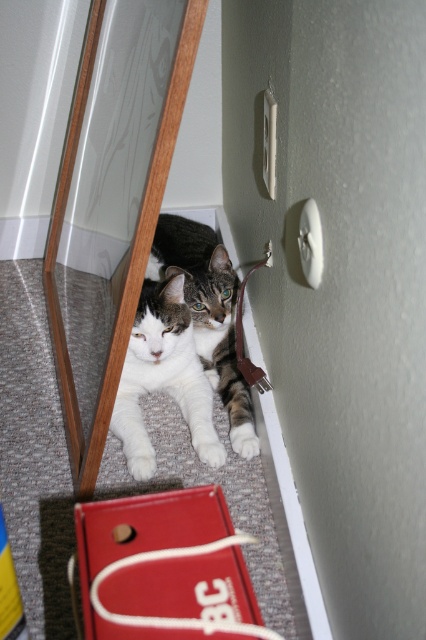
In the scene shown: Is white fur tabby cat at lower left thinner than white fur cat at lower left?

Indeed, white fur tabby cat at lower left has a lesser width compared to white fur cat at lower left.

Who is more forward, (134, 397) or (215, 330)?

Positioned in front is point (134, 397).

Is point (166, 296) farther from camera compared to point (221, 365)?

That is False.

Find the location of a particular element. white fur tabby cat at lower left is located at coordinates (164, 378).

What are the coordinates of `wooden mirror at center` in the screenshot? It's located at (129, 244).

Does wooden mirror at center lie behind white fur tabby cat at lower left?

No, it is in front of white fur tabby cat at lower left.

Between point (86, 486) and point (141, 428), which one is positioned behind?

The point (141, 428) is more distant.

Image resolution: width=426 pixels, height=640 pixels. What are the coordinates of `wooden mirror at center` in the screenshot? It's located at (129, 244).

Is wooden mirror at center below white fur cat at lower left?

Actually, wooden mirror at center is above white fur cat at lower left.

Does wooden mirror at center appear on the left side of white fur cat at lower left?

Indeed, wooden mirror at center is positioned on the left side of white fur cat at lower left.

This screenshot has height=640, width=426. Identify the location of wooden mirror at center. (129, 244).